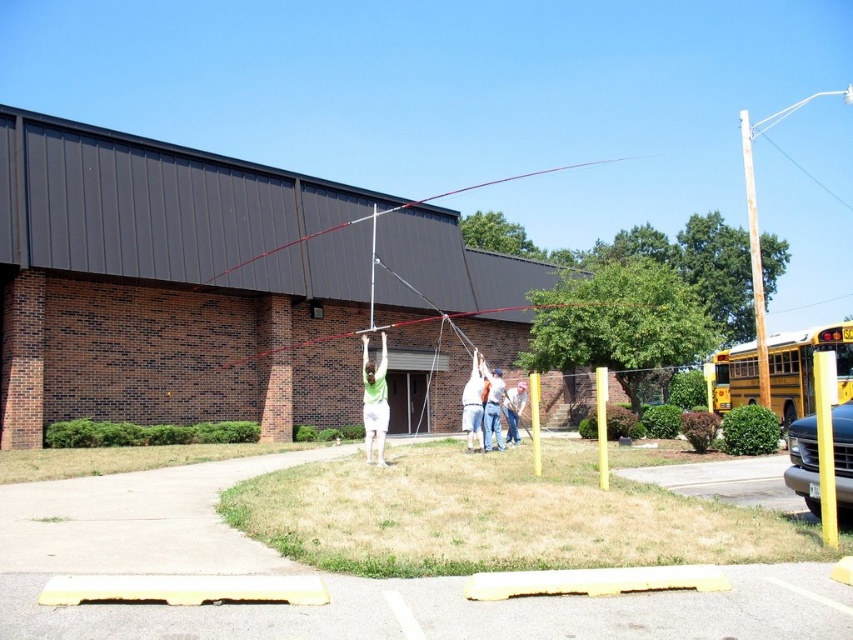
Is yellow wood post at center shorter than denim pants at center?

In fact, yellow wood post at center may be taller than denim pants at center.

From the picture: Does yellow wood post at center appear over denim pants at center?

Indeed, yellow wood post at center is positioned over denim pants at center.

Is point (602, 417) positioned before point (509, 403)?

Yes.

What are the coordinates of `yellow wood post at center` in the screenshot? It's located at (601, 426).

In the scene shown: Is yellow wood post at center in front of metallic pole at center?

Yes, yellow wood post at center is closer to the viewer.

Can you confirm if yellow wood post at center is taller than metallic pole at center?

No.

Is point (602, 372) farther from viewer compared to point (372, 234)?

That is False.

The height and width of the screenshot is (640, 853). I want to click on yellow wood post at center, so click(x=601, y=426).

Between white cotton shorts at center and metallic silver pole at center, which one appears on the left side from the viewer's perspective?

white cotton shorts at center is more to the left.

This screenshot has height=640, width=853. What are the coordinates of `white cotton shorts at center` in the screenshot? It's located at (374, 401).